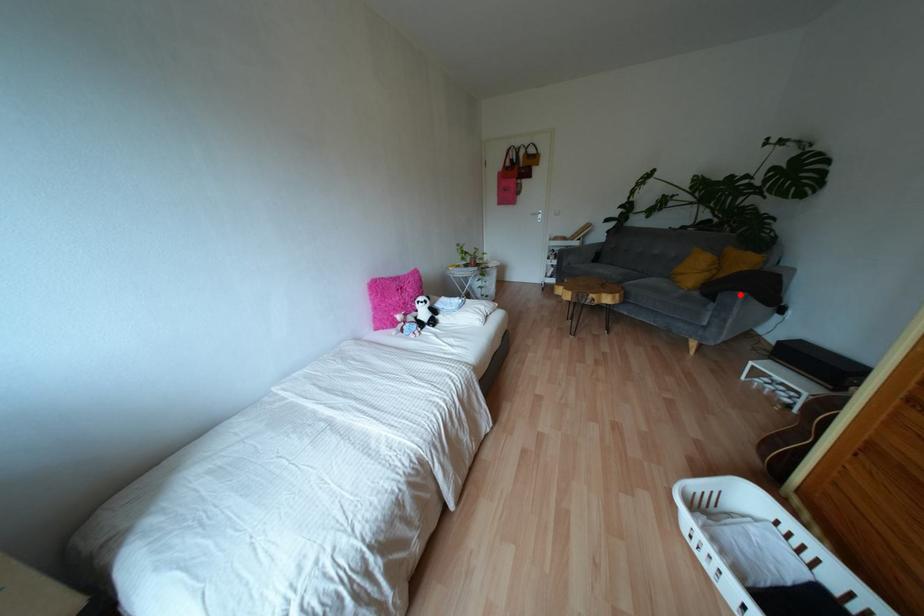
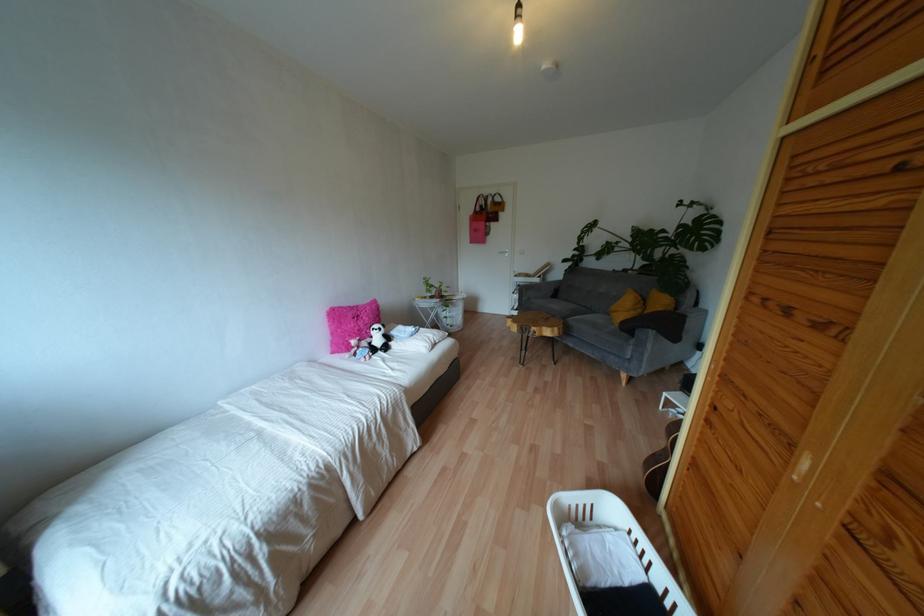
Question: I am providing you with two images of the same scene from different viewpoints. A red point is marked on the first image. At the location where the point appears in image 1, is it still visible in image 2?

Choices:
 (A) Yes
 (B) No

Answer: (A)